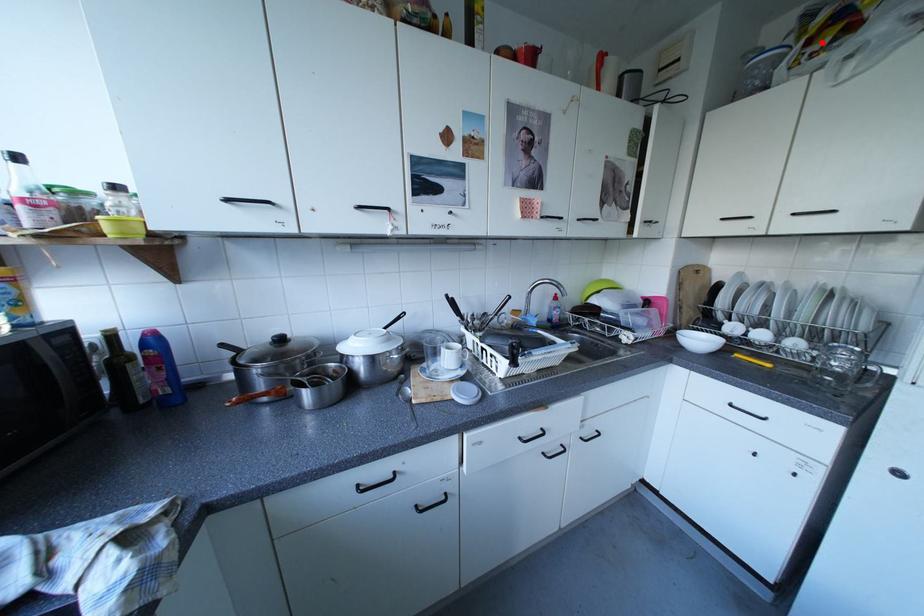
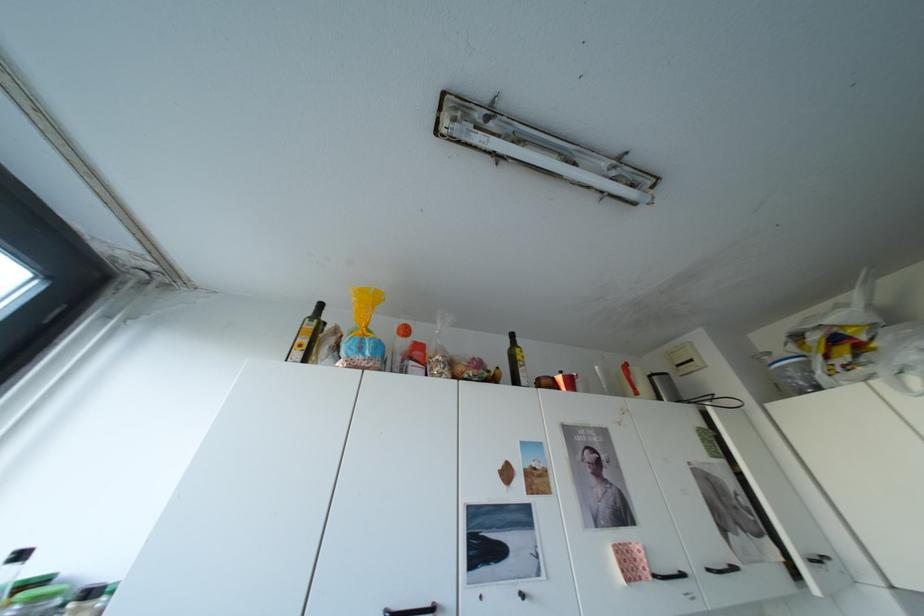
Question: A red point is marked in image1. In image2, is the corresponding 3D point closer to the camera or farther? Reply with the corresponding letter.

Choices:
 (A) The corresponding 3D point is closer.
 (B) The corresponding 3D point is farther.

Answer: (A)